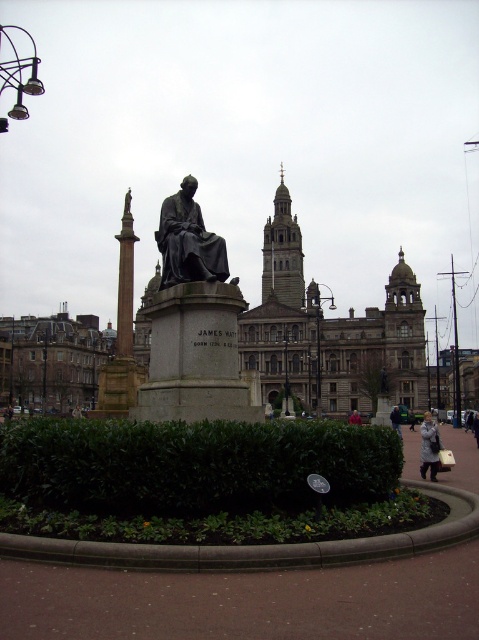
Question: Which object appears farthest from the camera in this image?

Choices:
 (A) light beige coat at lower right
 (B) bronze statue at center
 (C) green fabric jacket at lower right
 (D) light pink fabric coat at lower right

Answer: (A)

Question: Among these points, which one is nearest to the camera?

Choices:
 (A) (400, 419)
 (B) (83, 468)
 (C) (410, 419)
 (D) (353, 422)

Answer: (B)

Question: Does light gray coat at lower right have a lesser width compared to dark gray coat at center?

Choices:
 (A) no
 (B) yes

Answer: (A)

Question: Where is green fabric jacket at lower right located in relation to light pink fabric coat at lower right in the image?

Choices:
 (A) left
 (B) right

Answer: (B)

Question: Can you confirm if bronze statue at center is positioned above light beige coat at lower right?

Choices:
 (A) yes
 (B) no

Answer: (A)

Question: Which point is farther to the camera?

Choices:
 (A) light beige coat at lower right
 (B) green fabric jacket at lower right
 (C) green leafy hedge at center
 (D) light gray coat at lower right

Answer: (A)